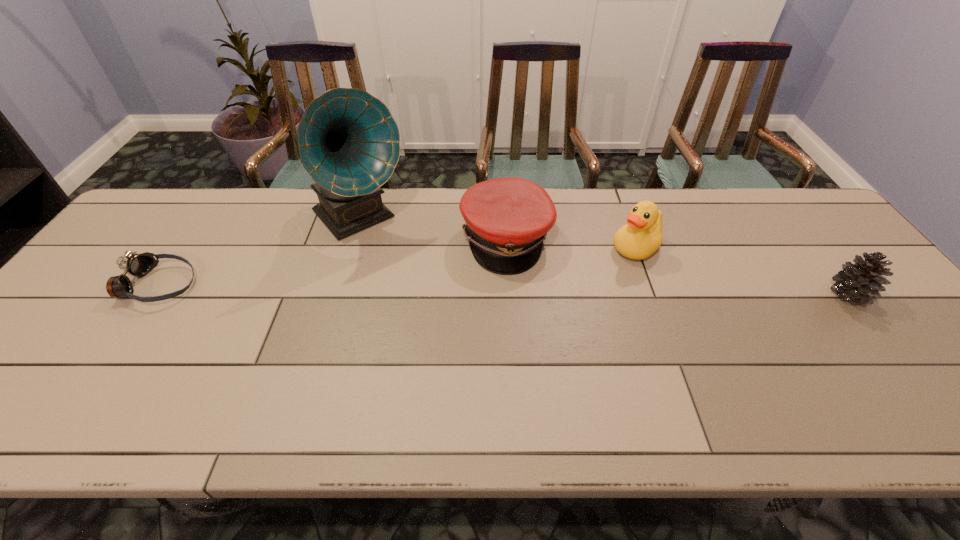
At what (x,y) coordinates should I click in order to perform the action: click on vacant point located between the cap and the goggles. Please return your answer as a coordinate pair (x, y). The width and height of the screenshot is (960, 540). Looking at the image, I should click on (332, 262).

Identify which object is located as the second nearest to the cap. Please provide its 2D coordinates. Your answer should be formatted as a tuple, i.e. [(x, y)], where the tuple contains the x and y coordinates of a point satisfying the conditions above.

[(642, 235)]

Identify which object is the third nearest to the shortest object. Please provide its 2D coordinates. Your answer should be formatted as a tuple, i.e. [(x, y)], where the tuple contains the x and y coordinates of a point satisfying the conditions above.

[(642, 235)]

Where is `blank space that satisfies the following two spatial constraints: 1. on the front side of the cap; 2. on the left side of the pinecone`? The width and height of the screenshot is (960, 540). blank space that satisfies the following two spatial constraints: 1. on the front side of the cap; 2. on the left side of the pinecone is located at coordinates (510, 294).

Identify the location of free space that satisfies the following two spatial constraints: 1. on the front side of the third object from right to left; 2. on the right side of the second object from right to left. (507, 248).

I want to click on vacant space that satisfies the following two spatial constraints: 1. on the front side of the cap; 2. on the right side of the rightmost object, so click(510, 294).